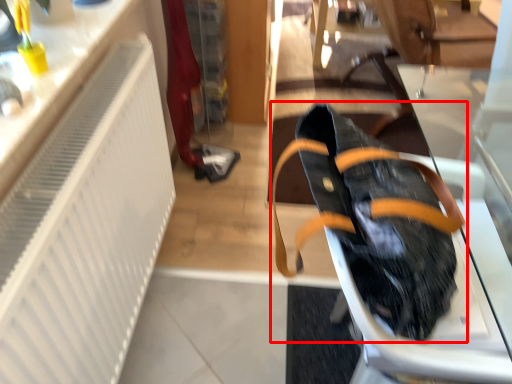
Question: From the image's perspective, where is footwear (annotated by the red box) located relative to radiator?

Choices:
 (A) below
 (B) above

Answer: (B)